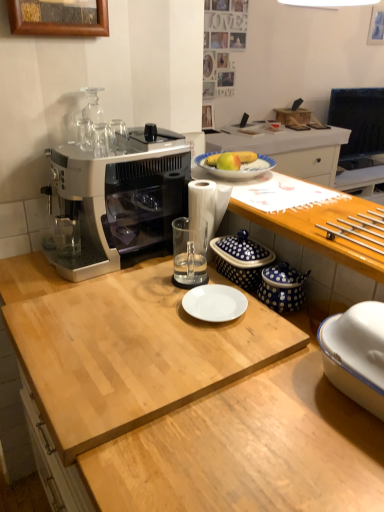
Where is `empty space that is ontop of wooden at upper right, the 2th desk in the bottom-to-top sequence`? The height and width of the screenshot is (512, 384). empty space that is ontop of wooden at upper right, the 2th desk in the bottom-to-top sequence is located at coordinates (306, 201).